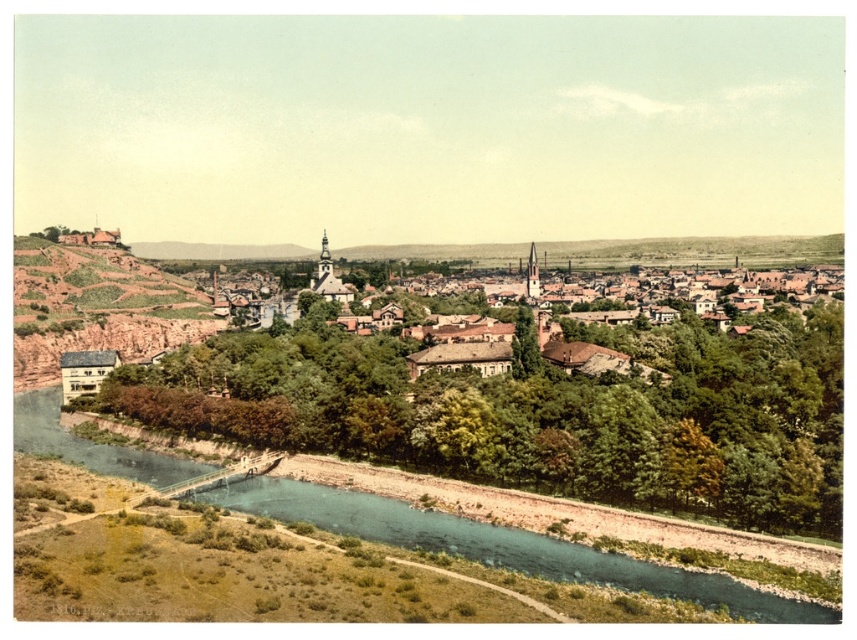
Question: Is greenish-blue water at lower center positioned behind brown rocky hillside at left?

Choices:
 (A) no
 (B) yes

Answer: (A)

Question: Which of the following is the closest to the observer?

Choices:
 (A) (802, 620)
 (B) (447, 406)
 (C) (130, 317)

Answer: (A)

Question: Which object is closer to the camera taking this photo?

Choices:
 (A) greenish-blue water at lower center
 (B) green leafy trees at center
 (C) brown rocky hillside at left

Answer: (A)

Question: Which point appears farthest from the camera in this image?

Choices:
 (A) (478, 404)
 (B) (507, 547)
 (C) (45, 358)

Answer: (C)

Question: From the image, what is the correct spatial relationship of green leafy trees at center in relation to brown rocky hillside at left?

Choices:
 (A) above
 (B) below

Answer: (B)

Question: Is greenish-blue water at lower center wider than brown rocky hillside at left?

Choices:
 (A) yes
 (B) no

Answer: (A)